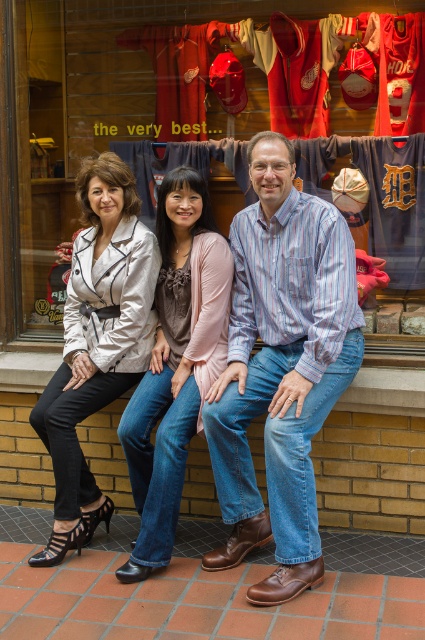
Question: Can you confirm if matte jersey at center is thinner than denim jeans at center?

Choices:
 (A) no
 (B) yes

Answer: (A)

Question: Considering the relative positions of matte black jacket at center and blue striped shirt at center in the image provided, where is matte black jacket at center located with respect to blue striped shirt at center?

Choices:
 (A) above
 (B) below

Answer: (A)

Question: Which point appears closest to the camera in this image?

Choices:
 (A) (79, 323)
 (B) (56, 237)
 (C) (320, 378)
 (D) (176, 308)

Answer: (C)

Question: Based on their relative distances, which object is farther from the matte white blazer at center?

Choices:
 (A) denim jeans at center
 (B) matte black jacket at center
 (C) matte jersey at center

Answer: (C)

Question: Can you confirm if matte black jacket at center is positioned below matte white blazer at center?

Choices:
 (A) no
 (B) yes

Answer: (B)

Question: Which of the following is the farthest from the observer?

Choices:
 (A) click(127, 428)
 (B) click(323, 392)
 (C) click(246, 403)

Answer: (A)